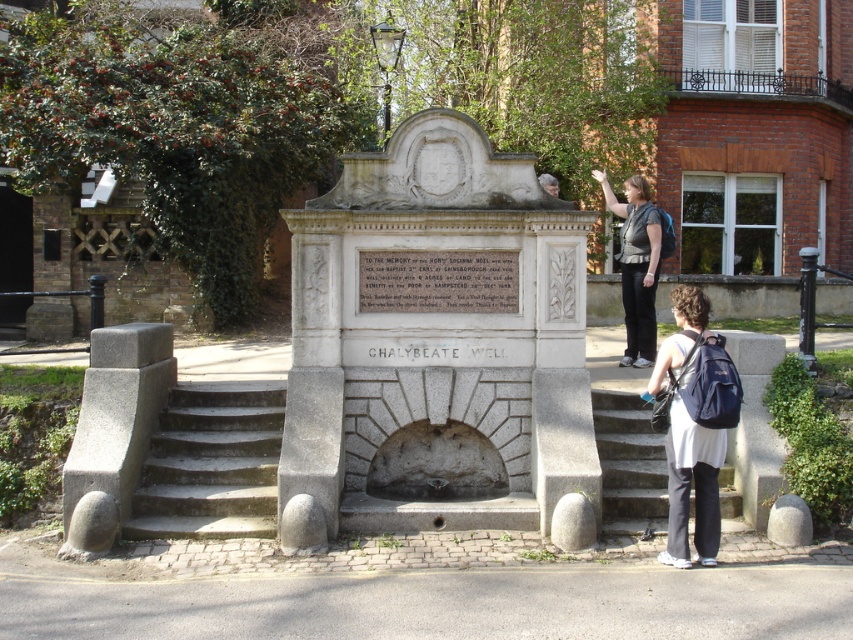
Question: Which object is farther from the camera taking this photo?

Choices:
 (A) white stone plaque at center
 (B) light brown hair at upper center
 (C) gray stone stairs at center

Answer: (B)

Question: Considering the relative positions of white stone plaque at center and light brown hair at upper center in the image provided, where is white stone plaque at center located with respect to light brown hair at upper center?

Choices:
 (A) right
 (B) left

Answer: (B)

Question: Is gray stone stairs at center below light brown hair at upper center?

Choices:
 (A) no
 (B) yes

Answer: (B)

Question: Does dark blue backpack at lower right have a larger size compared to dark gray fabric jacket at upper center?

Choices:
 (A) no
 (B) yes

Answer: (A)

Question: Which object appears closest to the camera in this image?

Choices:
 (A) dark blue backpack at lower right
 (B) white stone plaque at center
 (C) light brown hair at upper center
 (D) gray concrete stairs at lower left

Answer: (A)

Question: Which object is positioned farthest from the dark blue backpack at lower right?

Choices:
 (A) dark gray fabric jacket at upper center
 (B) light brown hair at upper center
 (C) gray concrete stairs at lower left
 (D) white stone fountain at center

Answer: (C)